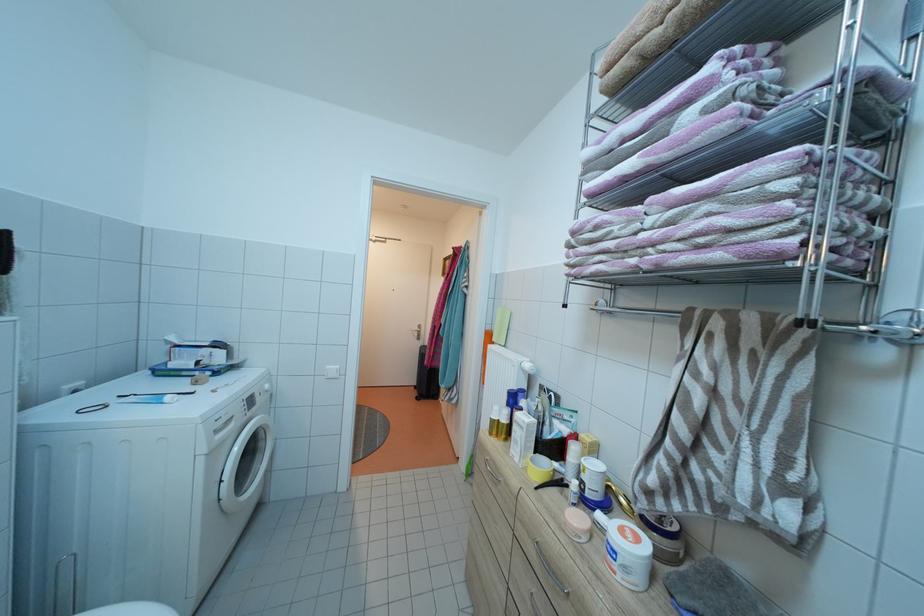
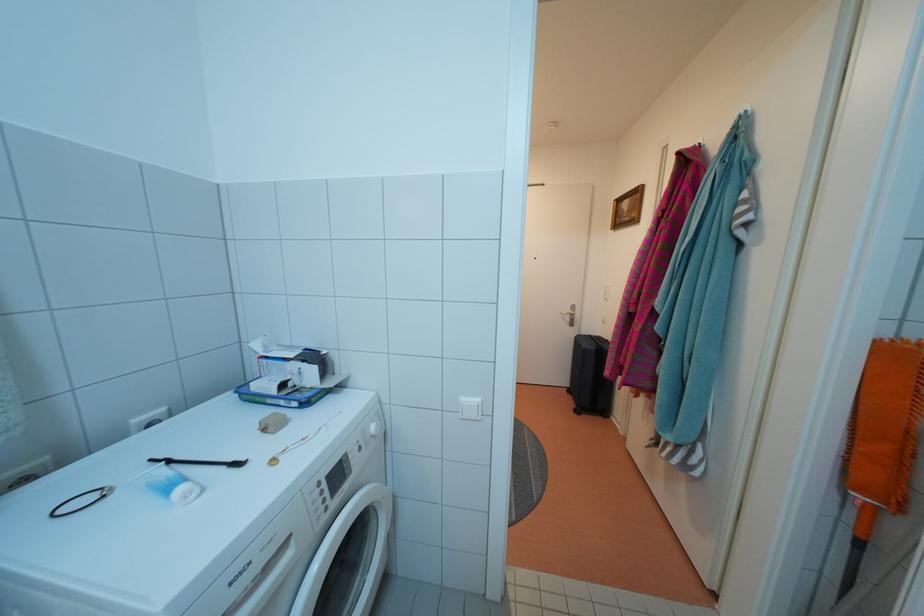
Question: Based on the continuous images, in which direction is the camera rotating? Reply with the corresponding letter.

Choices:
 (A) Left
 (B) Right
 (C) Up
 (D) Down

Answer: (A)